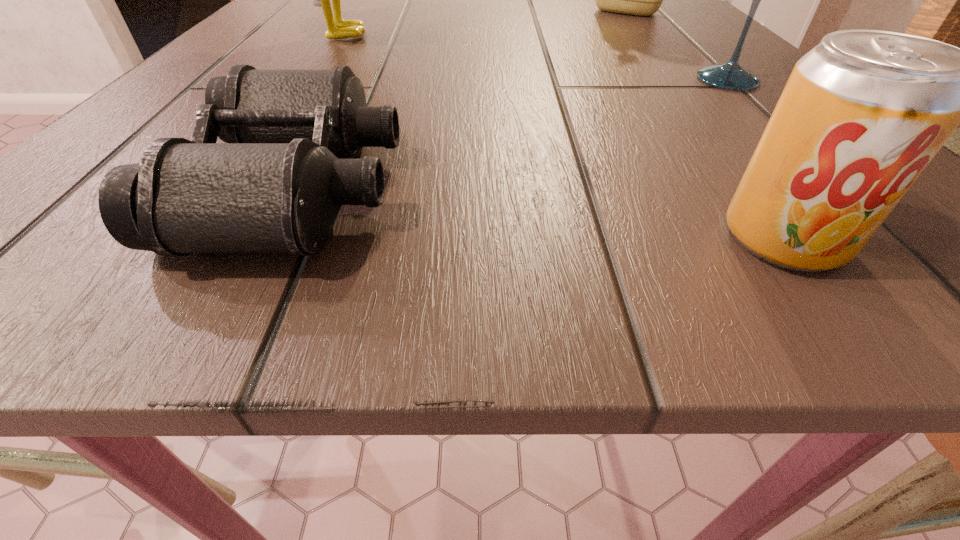
Find the location of a particular element. the tallest object is located at coordinates [337, 28].

At what (x,y) coordinates should I click in order to perform the action: click on detergent. Please return your answer as a coordinate pair (x, y). Looking at the image, I should click on (641, 0).

In order to click on martini in this screenshot , I will do `click(731, 76)`.

The width and height of the screenshot is (960, 540). Identify the location of the third farthest object. (731, 76).

This screenshot has height=540, width=960. What are the coordinates of `pop (soda)` in the screenshot? It's located at (863, 113).

You are a GUI agent. You are given a task and a screenshot of the screen. Output one action in this format:
    pyautogui.click(x=<x>, y=<y>)
    Task: Click on the shortest object
    
    Given the screenshot: What is the action you would take?
    pos(276,186)

Identify the location of vacant region located 0.350m on the beak of the gull. (635, 34).

Locate an element on the screen. The height and width of the screenshot is (540, 960). vacant position located on the left of the detergent is located at coordinates (404, 12).

Identify the location of vacant point located on the left of the third shortest object. (550, 80).

Where is `vacant area situated on the left of the second shortest object`? This screenshot has width=960, height=540. vacant area situated on the left of the second shortest object is located at coordinates (480, 239).